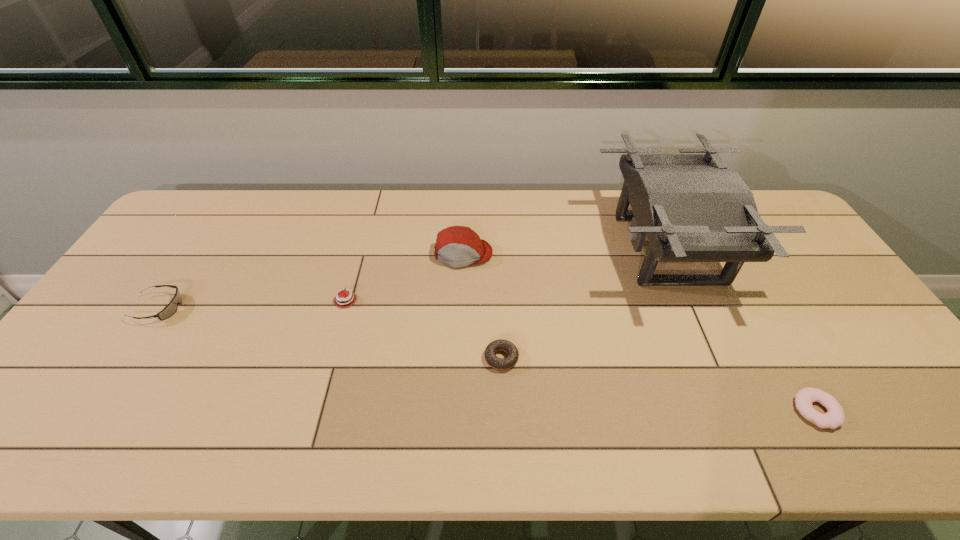
Locate an element on the screen. The image size is (960, 540). the tallest object is located at coordinates (692, 208).

Where is `the fifth shortest object`? Image resolution: width=960 pixels, height=540 pixels. the fifth shortest object is located at coordinates (456, 246).

You are a GUI agent. You are given a task and a screenshot of the screen. Output one action in this format:
    pyautogui.click(x=<x>, y=<y>)
    Task: Click on the third tallest object
    Image resolution: width=960 pixels, height=540 pixels.
    Given the screenshot: What is the action you would take?
    pyautogui.click(x=171, y=308)

Locate an element on the screen. The height and width of the screenshot is (540, 960). goggles is located at coordinates (171, 308).

You are a GUI agent. You are given a task and a screenshot of the screen. Output one action in this format:
    pyautogui.click(x=<x>, y=<y>)
    Task: Click on the second object from left to right
    
    Given the screenshot: What is the action you would take?
    pyautogui.click(x=351, y=298)

Image resolution: width=960 pixels, height=540 pixels. I want to click on the fifth farthest object, so click(x=492, y=360).

Locate an element on the screen. The height and width of the screenshot is (540, 960). the farther doughnut is located at coordinates (492, 360).

At what (x,y) coordinates should I click in order to perform the action: click on the shorter doughnut. Please return your answer as a coordinate pair (x, y). This screenshot has width=960, height=540. Looking at the image, I should click on (835, 417).

Find the location of a particular element. This screenshot has width=960, height=540. the right doughnut is located at coordinates (835, 417).

Find the location of `free space located with a camera mounted on the underside of the drone`. free space located with a camera mounted on the underside of the drone is located at coordinates (474, 249).